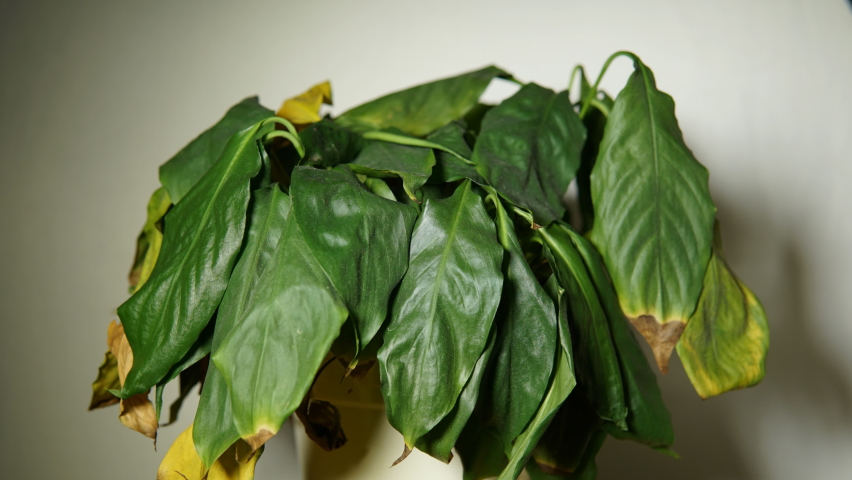
At what (x,y) coordinates should I click in order to perform the action: click on houseplant. Please return your answer as a coordinate pair (x, y). The image size is (852, 480). Looking at the image, I should click on (426, 272).